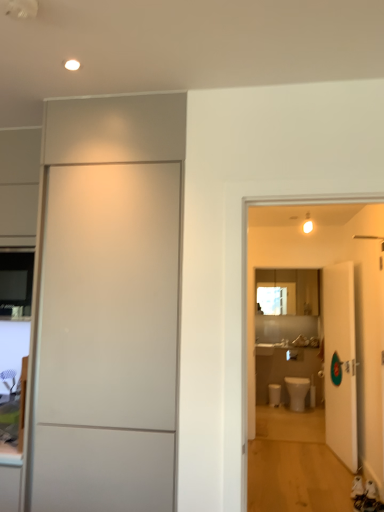
What do you see at coordinates (108, 340) in the screenshot?
I see `white matte door at left, arranged as the 2th door when viewed from the right` at bounding box center [108, 340].

Image resolution: width=384 pixels, height=512 pixels. What are the coordinates of `white glossy toilet bowl at lower center` in the screenshot? It's located at (274, 394).

The width and height of the screenshot is (384, 512). Describe the element at coordinates (297, 392) in the screenshot. I see `white glossy toilet at center` at that location.

Image resolution: width=384 pixels, height=512 pixels. I want to click on white glossy door at right, the first door when ordered from right to left, so click(340, 362).

Is white glossy toilet bowl at lower center aimed at white glossy toilet at center?

No.

Which object is thinner, white glossy toilet bowl at lower center or white glossy toilet at center?

With smaller width is white glossy toilet bowl at lower center.

Which object is more forward, white glossy toilet bowl at lower center or white glossy toilet at center?

white glossy toilet at center.

How many degrees apart are the facing directions of white glossy toilet bowl at lower center and white glossy toilet at center?

The facing directions of white glossy toilet bowl at lower center and white glossy toilet at center are 1.07 degrees apart.

Which is more to the left, white glossy toilet at center or white matte door at left, which is counted as the 1th door, starting from the left?

Positioned to the left is white matte door at left, which is counted as the 1th door, starting from the left.

From the image's perspective, between white glossy toilet at center and white matte door at left, arranged as the 2th door when viewed from the right, which one is located above?

white matte door at left, arranged as the 2th door when viewed from the right.

In the image, is white glossy toilet at center positioned in front of or behind white matte door at left, which is counted as the 1th door, starting from the left?

Clearly, white glossy toilet at center is behind white matte door at left, which is counted as the 1th door, starting from the left.

Which object is more forward, white glossy toilet at center or white glossy door at right, positioned as the first door in back-to-front order?

white glossy door at right, positioned as the first door in back-to-front order, is more forward.

Is white glossy toilet at center completely or partially outside of white glossy door at right, positioned as the second door in left-to-right order?

Yes, white glossy toilet at center is located beyond the bounds of white glossy door at right, positioned as the second door in left-to-right order.

From a real-world perspective, relative to white glossy door at right, the first door when ordered from right to left, is white glossy toilet at center vertically above or below?

white glossy toilet at center is below white glossy door at right, the first door when ordered from right to left.

Which is nearer, (346, 411) or (301, 388)?

The point (346, 411) is closer to the camera.

From a real-world perspective, who is located lower, white glossy door at right, positioned as the first door in back-to-front order, or white glossy toilet at center?

white glossy toilet at center.

Considering the relative sizes of white glossy door at right, positioned as the second door in left-to-right order, and white glossy toilet at center in the image provided, is white glossy door at right, positioned as the second door in left-to-right order, thinner than white glossy toilet at center?

Yes.

You are a GUI agent. You are given a task and a screenshot of the screen. Output one action in this format:
    pyautogui.click(x=<x>, y=<y>)
    Task: Click on the door that is the 1st one when counting leftward from the white glossy toilet at center
    
    Given the screenshot: What is the action you would take?
    pyautogui.click(x=340, y=362)

Is white glossy toilet bowl at lower center located outside white matte door at left, which is counted as the 1th door, starting from the left?

Indeed, white glossy toilet bowl at lower center is completely outside white matte door at left, which is counted as the 1th door, starting from the left.

From the image's perspective, which object appears higher, white glossy toilet bowl at lower center or white matte door at left, the first door from the front?

white matte door at left, the first door from the front.

What's the angular difference between white glossy toilet bowl at lower center and white matte door at left, the first door from the front,'s facing directions?

There is a 0.269-degree angle between the facing directions of white glossy toilet bowl at lower center and white matte door at left, the first door from the front.

Does white glossy toilet bowl at lower center come behind white matte door at left, which is counted as the 1th door, starting from the left?

Yes, white glossy toilet bowl at lower center is further from the viewer.

Are white glossy toilet at center and white glossy toilet bowl at lower center located far from each other?

Actually, white glossy toilet at center and white glossy toilet bowl at lower center are a little close together.

Which is in front, white glossy toilet at center or white glossy toilet bowl at lower center?

white glossy toilet at center is more forward.

Consider the image. Does white glossy toilet at center have a larger size compared to white glossy toilet bowl at lower center?

Yes.

Do you think white glossy door at right, which is counted as the 2th door, starting from the front, is within white glossy toilet bowl at lower center, or outside of it?

white glossy door at right, which is counted as the 2th door, starting from the front, is spatially situated outside white glossy toilet bowl at lower center.

Between white glossy door at right, positioned as the second door in left-to-right order, and white glossy toilet bowl at lower center, which one has larger size?

With larger size is white glossy door at right, positioned as the second door in left-to-right order.

Is white glossy door at right, positioned as the first door in back-to-front order, aimed at white glossy toilet bowl at lower center?

No, white glossy door at right, positioned as the first door in back-to-front order, is not aimed at white glossy toilet bowl at lower center.

Considering the relative positions of white glossy door at right, positioned as the second door in left-to-right order, and white glossy toilet bowl at lower center in the image provided, is white glossy door at right, positioned as the second door in left-to-right order, to the left or to the right of white glossy toilet bowl at lower center?

Clearly, white glossy door at right, positioned as the second door in left-to-right order, is on the right of white glossy toilet bowl at lower center in the image.

In the image, there is a white glossy toilet at center. Identify the location of toilet bowl below it (from the image's perspective). Image resolution: width=384 pixels, height=512 pixels. (274, 394).

The image size is (384, 512). I want to click on the 2nd door in front when counting from the white glossy toilet at center, so click(108, 340).

Based on their spatial positions, is white matte door at left, the first door from the front, or white glossy toilet bowl at lower center closer to white glossy toilet at center?

white glossy toilet bowl at lower center lies closer to white glossy toilet at center than the other object.

Based on their spatial positions, is white glossy toilet at center or white glossy door at right, positioned as the second door in left-to-right order, closer to white matte door at left, which is counted as the 1th door, starting from the left?

white glossy door at right, positioned as the second door in left-to-right order, is positioned closer to the anchor white matte door at left, which is counted as the 1th door, starting from the left.

Considering their positions, is white glossy toilet bowl at lower center positioned closer to white glossy toilet at center than white matte door at left, the first door from the front?

white glossy toilet bowl at lower center lies closer to white glossy toilet at center than the other object.

Looking at this image, which object lies nearer to the anchor point white glossy door at right, which is counted as the 2th door, starting from the front, white glossy toilet at center or white matte door at left, which is counted as the 1th door, starting from the left?

white glossy toilet at center lies closer to white glossy door at right, which is counted as the 2th door, starting from the front, than the other object.

When comparing their distances from white glossy toilet at center, does white glossy door at right, positioned as the first door in back-to-front order, or white glossy toilet bowl at lower center seem closer?

Among the two, white glossy toilet bowl at lower center is located nearer to white glossy toilet at center.

Which object lies further to the anchor point white glossy toilet at center, white glossy toilet bowl at lower center or white glossy door at right, the first door when ordered from right to left?

Among the two, white glossy door at right, the first door when ordered from right to left, is located further to white glossy toilet at center.

From the image, which object appears to be farther from white glossy door at right, the first door when ordered from right to left, white matte door at left, which is the 2th door from back to front, or white glossy toilet bowl at lower center?

The object further to white glossy door at right, the first door when ordered from right to left, is white matte door at left, which is the 2th door from back to front.

Based on the photo, which object lies further to the anchor point white glossy toilet bowl at lower center, white glossy door at right, positioned as the second door in left-to-right order, or white glossy toilet at center?

white glossy door at right, positioned as the second door in left-to-right order, lies further to white glossy toilet bowl at lower center than the other object.

The image size is (384, 512). I want to click on door between white matte door at left, which is counted as the 1th door, starting from the left, and white glossy toilet bowl at lower center, along the z-axis, so click(x=340, y=362).

Locate an element on the screen. This screenshot has height=512, width=384. door between white matte door at left, which is counted as the 1th door, starting from the left, and white glossy toilet at center in the front-back direction is located at coordinates (340, 362).

You are a GUI agent. You are given a task and a screenshot of the screen. Output one action in this format:
    pyautogui.click(x=<x>, y=<y>)
    Task: Click on the toilet positioned between white glossy door at right, positioned as the first door in back-to-front order, and white glossy toilet bowl at lower center from near to far
    This screenshot has width=384, height=512.
    Given the screenshot: What is the action you would take?
    pyautogui.click(x=297, y=392)

Image resolution: width=384 pixels, height=512 pixels. I want to click on toilet between white matte door at left, which is counted as the 1th door, starting from the left, and white glossy toilet bowl at lower center from front to back, so click(297, 392).